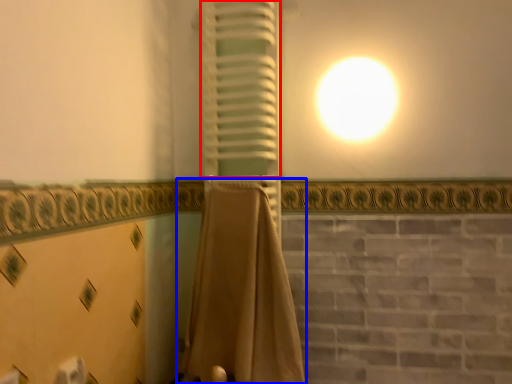
Question: Which object is closer to the camera taking this photo, curtain (highlighted by a red box) or curtain (highlighted by a blue box)?

Choices:
 (A) curtain
 (B) curtain

Answer: (B)